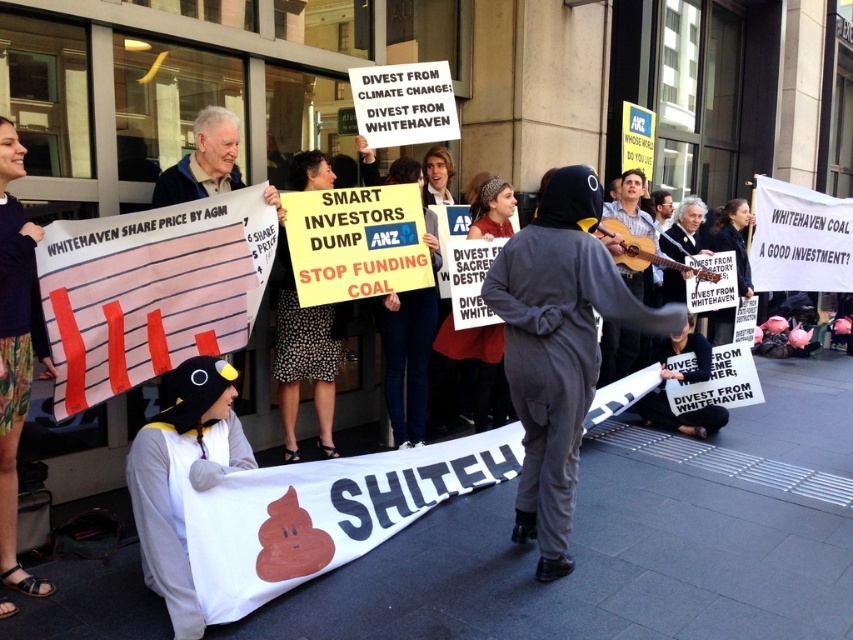
You are a photographer trying to capture a photo of the protest scene. You notice two points in the image at coordinates point (186, 572) and point (24, 292). Which point is closer to the camera?

Point (186, 572) is in front of point (24, 292), so it is closer to the camera.

Looking at this image, you are a photographer at the protest scene. You need to capture a photo that includes both the gray penguin costume at lower left and the floral skirt at lower left. Which object should you position to the left side of your frame to ensure both are in the shot?

You should position the floral skirt at lower left on the left side of your frame because the gray penguin costume at lower left is to the right of it, ensuring both are included in the photo.